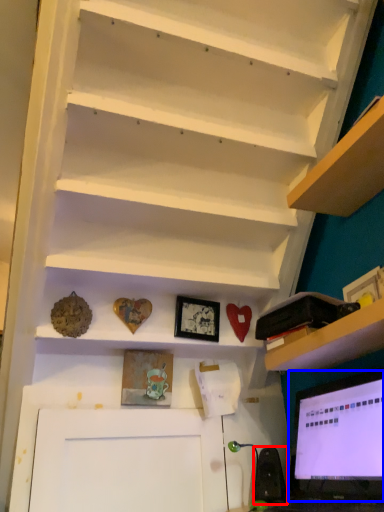
Question: Which object appears farthest to the camera in this image, speaker (highlighted by a red box) or computer monitor (highlighted by a blue box)?

Choices:
 (A) speaker
 (B) computer monitor

Answer: (A)